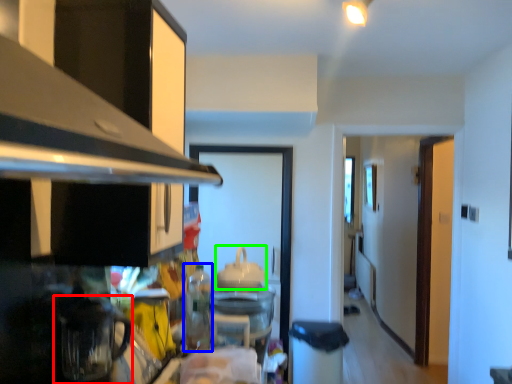
Question: Which object is positioned farthest from appliance (highlighted by a red box)? Select from appliance (highlighted by a blue box) and appliance (highlighted by a green box).

Choices:
 (A) appliance
 (B) appliance

Answer: (B)